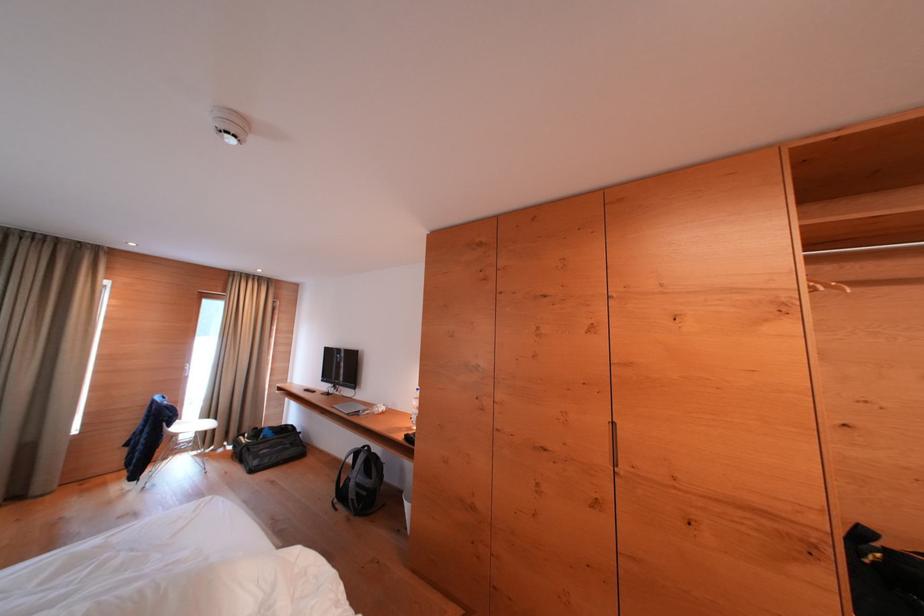
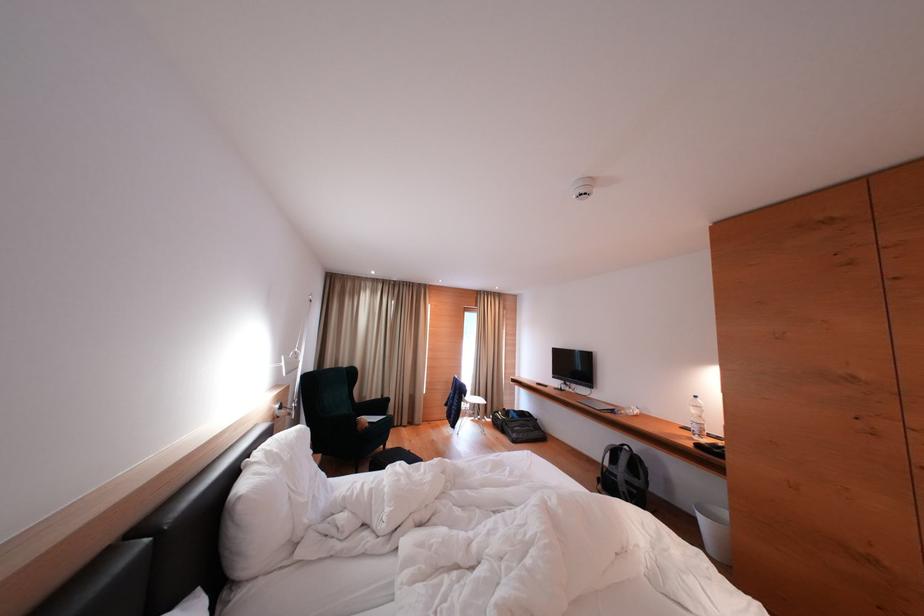
Locate, in the second image, the point that corresponds to point 367,450 in the first image.

(624, 448)